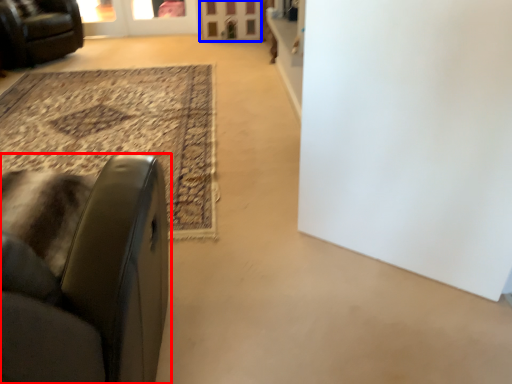
Question: Among these objects, which one is nearest to the camera, chair (highlighted by a red box) or screen door (highlighted by a blue box)?

Choices:
 (A) chair
 (B) screen door

Answer: (A)